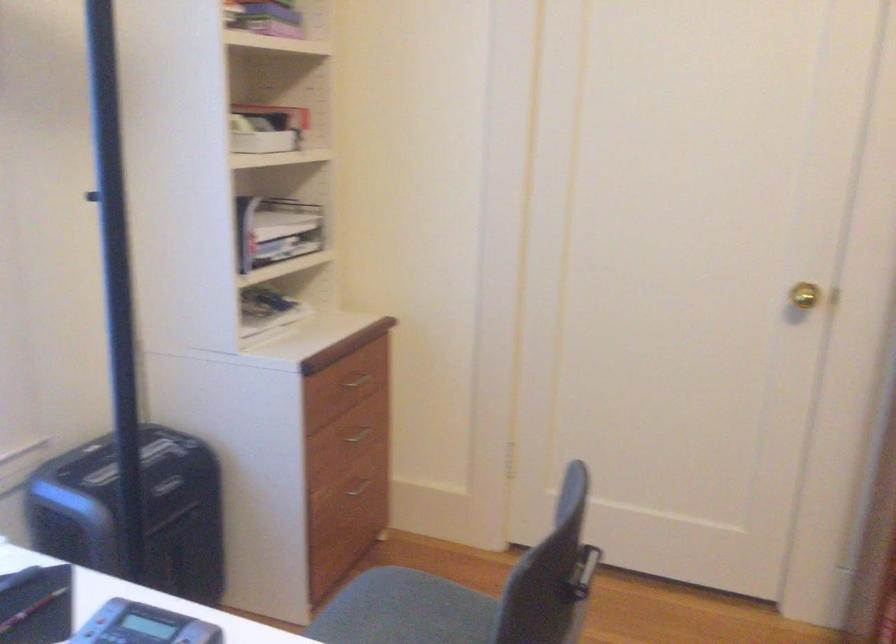
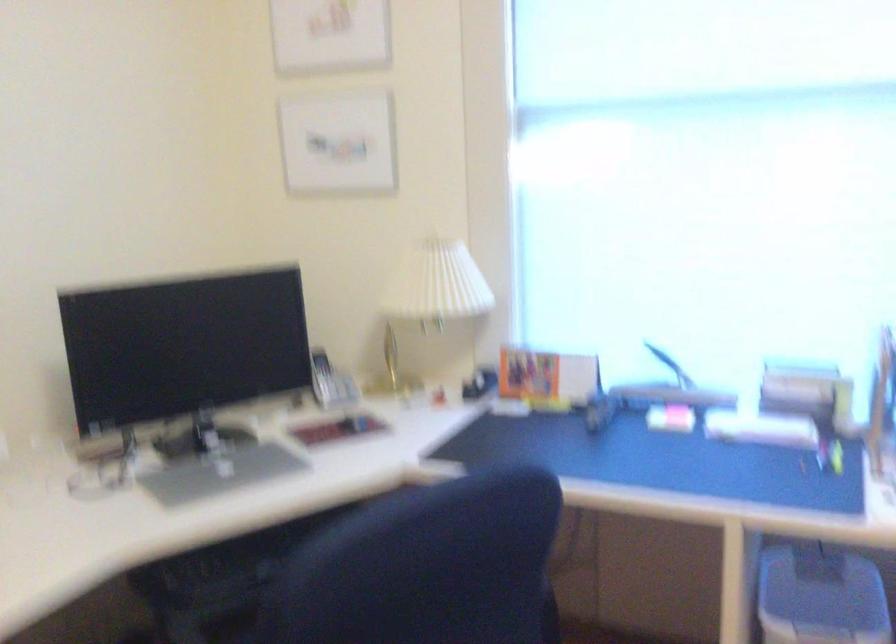
Question: The camera is either moving clockwise (left) or counter-clockwise (right) around the object. The first image is from the beginning of the video and the second image is from the end. Is the camera moving left or right when shooting the video?

Choices:
 (A) Left
 (B) Right

Answer: (B)